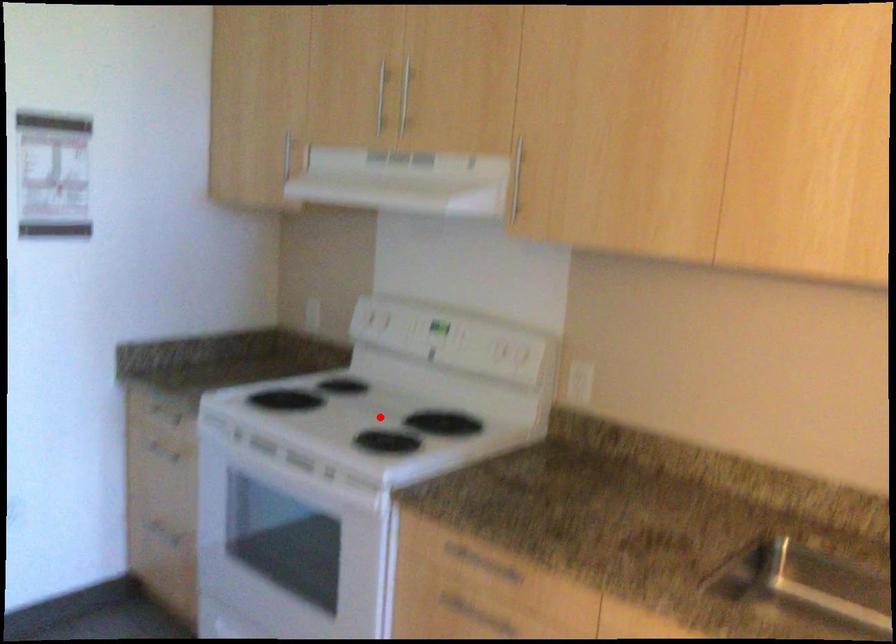
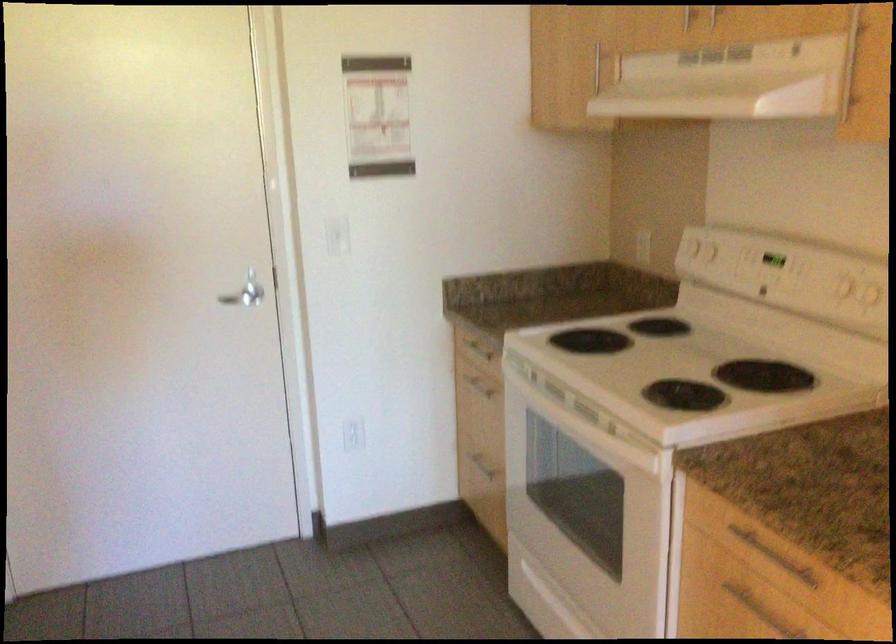
Find the pixel in the second image that matches the highlighted location in the first image.

(686, 365)